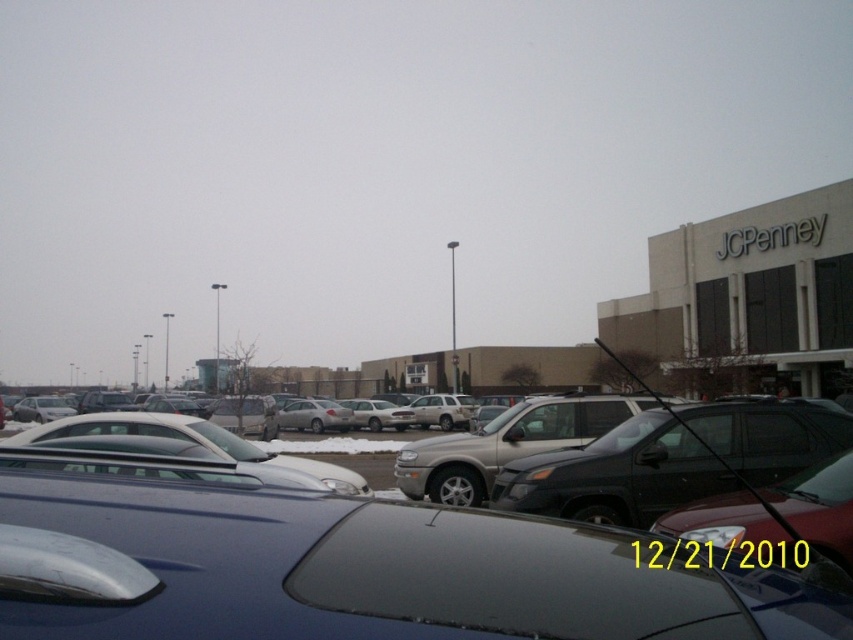
You are a delivery person trying to park your van in the parking lot. You see the shiny silver sedan at center and the satin black suv at center. Which vehicle should you move to the right to make space for your van?

You should move the satin black suv at center to the right since the shiny silver sedan at center is already on its left side, allowing more space when the suv is shifted right.

You are standing at the entrance of the shopping center and see the shiny silver sedan at center and the satin silver suv at center. Which vehicle is positioned closer to the left side of the parking lot?

The shiny silver sedan at center is positioned to the left of the satin silver suv at center, so it is closer to the left side of the parking lot.

You are standing in the parking lot of the shopping center and see the satin black suv at center and the satin silver suv at center. Which one is located to the right of the other?

The satin black suv at center is positioned on the right side of the satin silver suv at center.